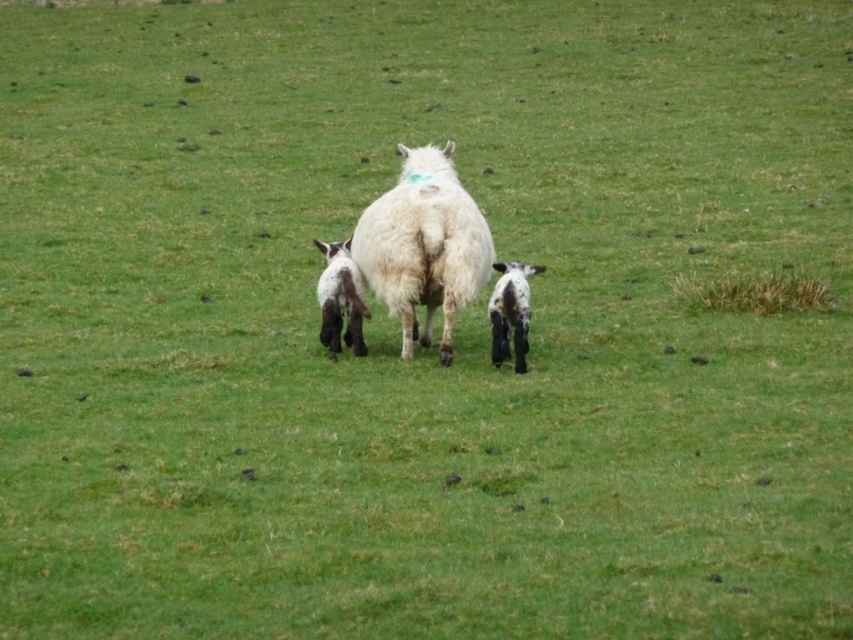
Question: Can you confirm if white fluffy sheep at center is smaller than black woolen goat at center?

Choices:
 (A) no
 (B) yes

Answer: (A)

Question: Which point appears closest to the camera in this image?

Choices:
 (A) (461, 292)
 (B) (515, 371)

Answer: (A)

Question: Which point is closer to the camera?

Choices:
 (A) (317, 246)
 (B) (355, 232)
 (C) (491, 323)

Answer: (C)

Question: Does white fluffy sheep at center have a larger size compared to black woolen goat at center?

Choices:
 (A) no
 (B) yes

Answer: (B)

Question: Is white fluffy sheep at center to the left of black woolen goat at center from the viewer's perspective?

Choices:
 (A) yes
 (B) no

Answer: (A)

Question: Among these points, which one is nearest to the camera?

Choices:
 (A) (343, 241)
 (B) (381, 195)

Answer: (A)